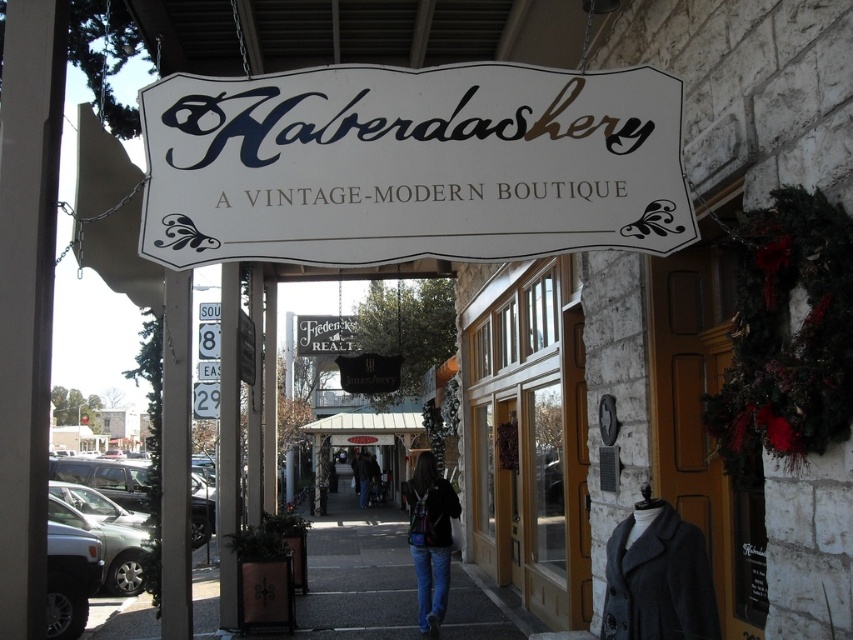
Question: Is white paper sign at center wider than denim jacket at center?

Choices:
 (A) no
 (B) yes

Answer: (B)

Question: Which point is closer to the camera?

Choices:
 (A) white paper sign at center
 (B) gray concrete sidewalk at center
 (C) white wooden signboard at center

Answer: (A)

Question: Considering the relative positions of white paper sign at center and denim jacket at center in the image provided, where is white paper sign at center located with respect to denim jacket at center?

Choices:
 (A) right
 (B) left

Answer: (A)

Question: Does white paper sign at center have a larger size compared to white wooden signboard at center?

Choices:
 (A) yes
 (B) no

Answer: (B)

Question: Which point is closer to the camera taking this photo?

Choices:
 (A) (341, 352)
 (B) (378, 476)

Answer: (A)

Question: Which point is closer to the camera?

Choices:
 (A) (354, 321)
 (B) (506, 189)
 (C) (409, 534)

Answer: (B)